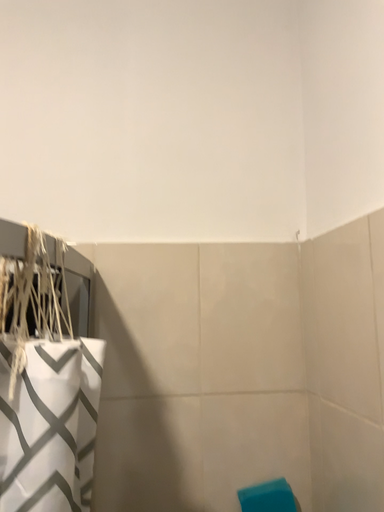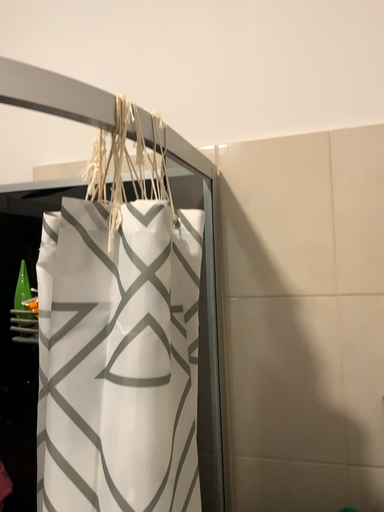
Question: Which way did the camera rotate in the video?

Choices:
 (A) rotated upward
 (B) rotated downward

Answer: (B)